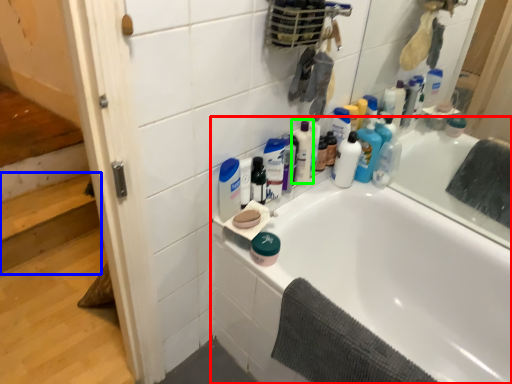
Question: Which object is the farthest from bathtub (highlighted by a red box)? Choose among these: stairwell (highlighted by a blue box) or cleaning product (highlighted by a green box).

Choices:
 (A) stairwell
 (B) cleaning product

Answer: (A)